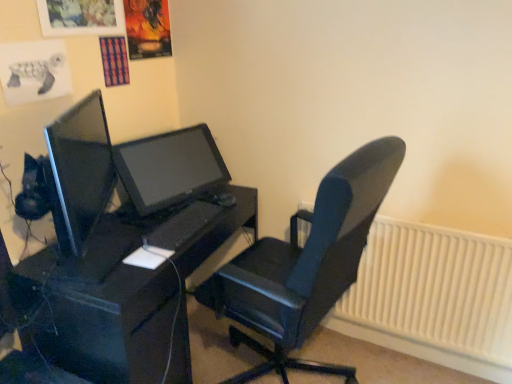
Question: From the image's perspective, is black matte desk at center over matte black monitor at center?

Choices:
 (A) yes
 (B) no

Answer: (B)

Question: Does black matte desk at center have a greater width compared to matte black monitor at center?

Choices:
 (A) no
 (B) yes

Answer: (B)

Question: Is black matte desk at center not close to matte black monitor at center?

Choices:
 (A) no
 (B) yes

Answer: (A)

Question: Is black matte desk at center closer to camera compared to matte black monitor at center?

Choices:
 (A) yes
 (B) no

Answer: (A)

Question: Is black matte desk at center shorter than matte black monitor at center?

Choices:
 (A) yes
 (B) no

Answer: (B)

Question: From the image's perspective, is white plastic radiator at lower right positioned above or below black leather chair at center?

Choices:
 (A) above
 (B) below

Answer: (B)

Question: From a real-world perspective, relative to black leather chair at center, is white plastic radiator at lower right vertically above or below?

Choices:
 (A) above
 (B) below

Answer: (B)

Question: Is white plastic radiator at lower right wider or thinner than black leather chair at center?

Choices:
 (A) wide
 (B) thin

Answer: (B)

Question: Which is correct: white plastic radiator at lower right is inside black leather chair at center, or outside of it?

Choices:
 (A) inside
 (B) outside

Answer: (B)

Question: From the image's perspective, is black leather chair at center positioned above or below black matte keyboard at center?

Choices:
 (A) above
 (B) below

Answer: (B)

Question: Is black leather chair at center inside the boundaries of black matte keyboard at center, or outside?

Choices:
 (A) outside
 (B) inside

Answer: (A)

Question: Is black leather chair at center in front of or behind black matte keyboard at center in the image?

Choices:
 (A) front
 (B) behind

Answer: (A)

Question: Considering the relative positions of black leather chair at center and black matte keyboard at center in the image provided, is black leather chair at center to the left or to the right of black matte keyboard at center?

Choices:
 (A) right
 (B) left

Answer: (A)

Question: Does point (348, 367) appear closer or farther from the camera than point (441, 355)?

Choices:
 (A) farther
 (B) closer

Answer: (B)

Question: Based on their positions, is black leather chair at center located to the left or right of white plastic radiator at lower right?

Choices:
 (A) right
 (B) left

Answer: (B)